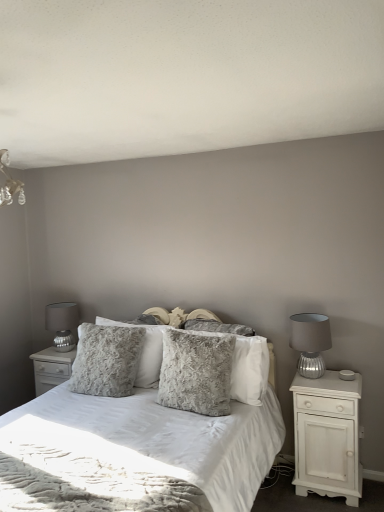
Question: Is fuzzy gray pillow at center, acting as the 2th pillow starting from the back, wider or thinner than fluffy gray pillow at center, the 1th pillow when ordered from back to front?

Choices:
 (A) wide
 (B) thin

Answer: (B)

Question: Does point (253, 393) appear closer or farther from the camera than point (117, 353)?

Choices:
 (A) farther
 (B) closer

Answer: (B)

Question: Based on their relative distances, which object is farther from the white wood nightstand at right, marked as the 1th nightstand in a right-to-left arrangement?

Choices:
 (A) fuzzy fabric bed at center
 (B) matte silver lamp at right, the 1th table lamp positioned from the front
 (C) fuzzy gray pillow at center, acting as the 2th pillow starting from the back
 (D) matte silver table lamp at left, which is counted as the 1th table lamp, starting from the left
 (E) fuzzy gray pillow at center, acting as the first pillow starting from the front

Answer: (D)

Question: Estimate the real-world distances between objects in this image. Which object is closer to the white textured nightstand at center, which is the 2th nightstand in right-to-left order?

Choices:
 (A) white wood nightstand at right, which ranks as the 2th nightstand in back-to-front order
 (B) fuzzy fabric bed at center
 (C) fuzzy gray pillow at center, marked as the second pillow in a front-to-back arrangement
 (D) matte silver table lamp at left, which ranks as the 2th table lamp in right-to-left order
 (E) matte silver lamp at right, the 1th table lamp positioned from the front

Answer: (D)